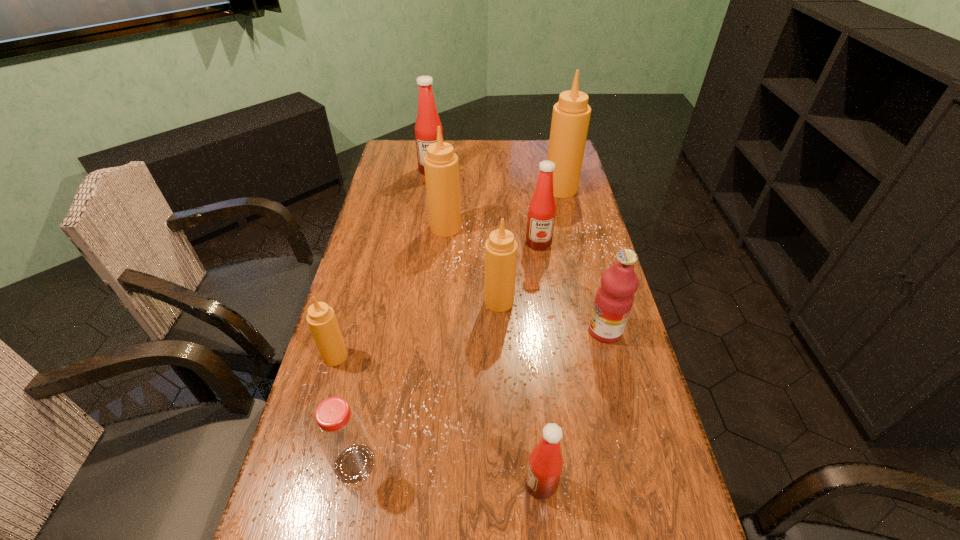
The height and width of the screenshot is (540, 960). Find the location of `blank area located on the front-facing side of the second farthest red condiment`. blank area located on the front-facing side of the second farthest red condiment is located at coordinates (543, 277).

The image size is (960, 540). Find the location of `vacant space situated 0.370m on the label of the fourth nearest object`. vacant space situated 0.370m on the label of the fourth nearest object is located at coordinates (454, 330).

The image size is (960, 540). I want to click on vacant position located 0.310m on the label of the fourth nearest object, so click(x=476, y=330).

What are the coordinates of `free point located on the label of the fourth nearest object` in the screenshot? It's located at (570, 330).

What are the coordinates of `blank space located 0.070m on the front of the leftmost object` in the screenshot? It's located at (325, 390).

Find the location of a particular element. The height and width of the screenshot is (540, 960). free space located 0.150m on the front-facing side of the nearest condiment is located at coordinates [454, 484].

This screenshot has width=960, height=540. Find the location of `blank area located 0.100m on the front-facing side of the nearest condiment`. blank area located 0.100m on the front-facing side of the nearest condiment is located at coordinates (478, 484).

This screenshot has width=960, height=540. In order to click on free space located on the front-facing side of the nearest condiment in this screenshot , I will do `click(468, 484)`.

The image size is (960, 540). I want to click on free spot located 0.320m on the right of the red bottle, so click(x=524, y=464).

Find the location of a particular element. The width and height of the screenshot is (960, 540). object at the far edge is located at coordinates (427, 122).